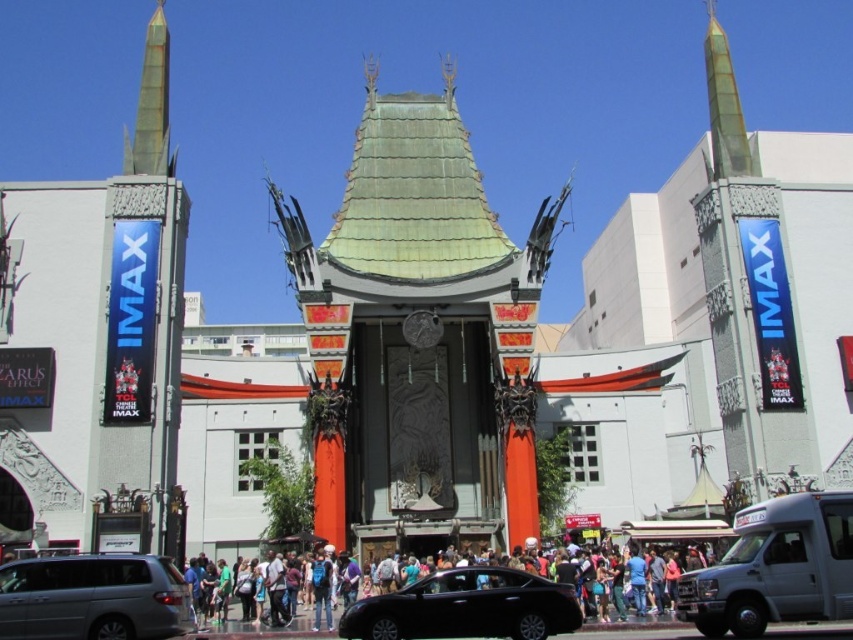
Question: Which point is farther from the camera taking this photo?

Choices:
 (A) (747, 560)
 (B) (363, 269)
 (C) (44, 557)
 (D) (584, 625)

Answer: (B)

Question: From the image, what is the correct spatial relationship of silver metallic van at lower left in relation to black glossy sedan at center?

Choices:
 (A) below
 (B) above

Answer: (B)

Question: Which point is closer to the camera?

Choices:
 (A) silver metallic van at lower left
 (B) silver metallic van at lower right
 (C) black glossy sedan at center

Answer: (A)

Question: Does green copper-colored roof at center have a larger size compared to matte black crowd at center?

Choices:
 (A) yes
 (B) no

Answer: (A)

Question: Which point is closer to the camera?

Choices:
 (A) (346, 612)
 (B) (86, 573)
 (C) (757, 577)
 (D) (321, 284)

Answer: (B)

Question: Can you confirm if silver metallic van at lower left is positioned above black glossy sedan at center?

Choices:
 (A) no
 (B) yes

Answer: (B)